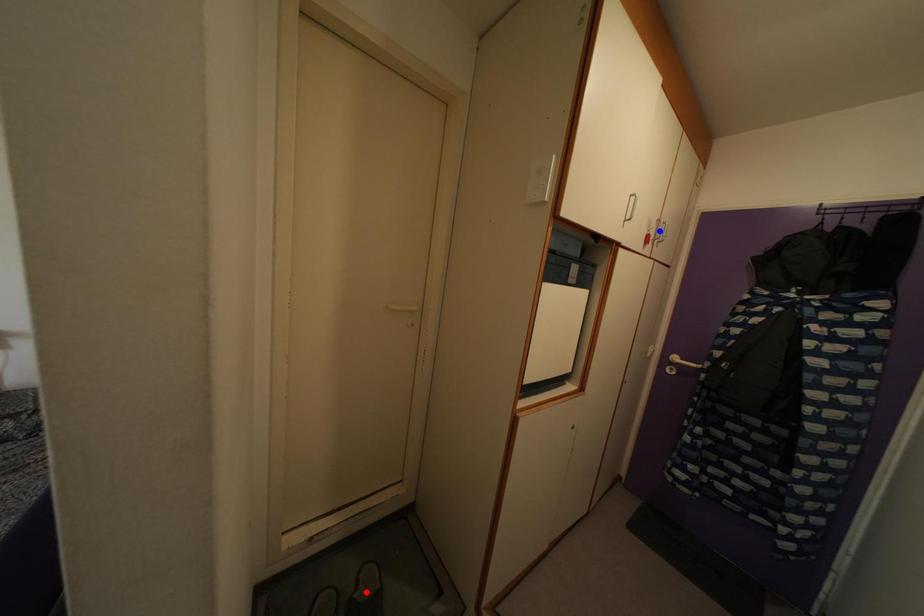
Question: In the image, two points are highlighted. Which point is nearer to the camera? Reply with the corresponding letter.

Choices:
 (A) blue point
 (B) red point

Answer: (A)